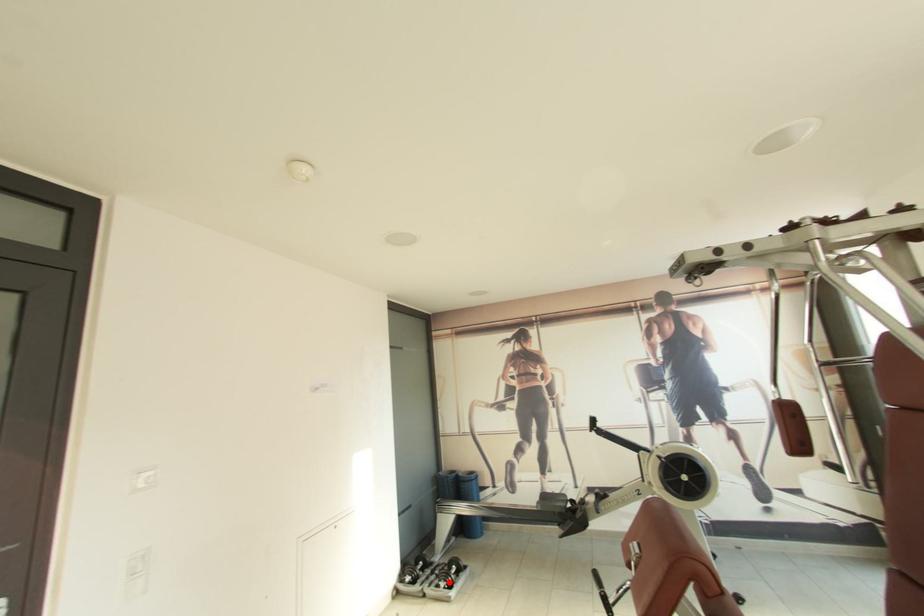
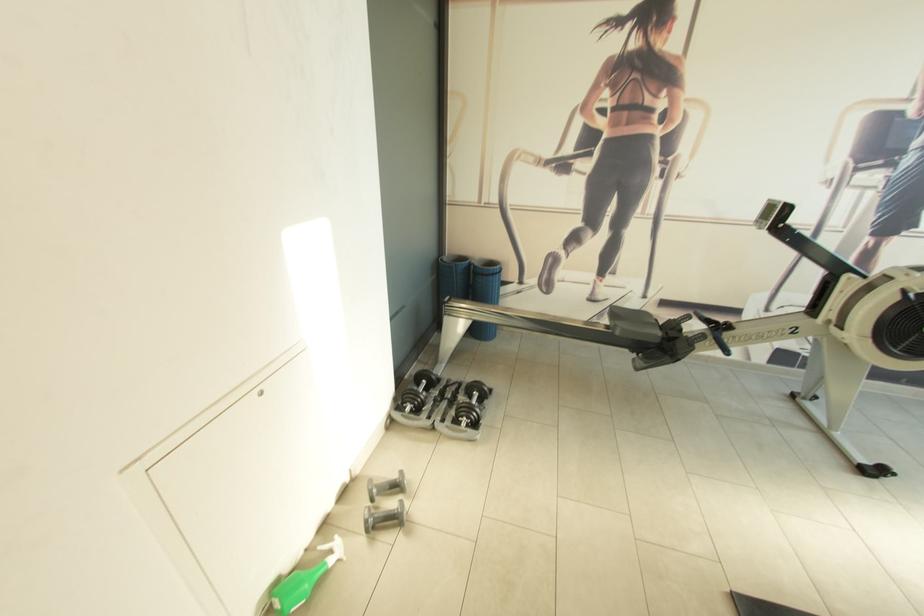
In the second image, find the point that corresponds to the highlighted location in the first image.

(472, 419)